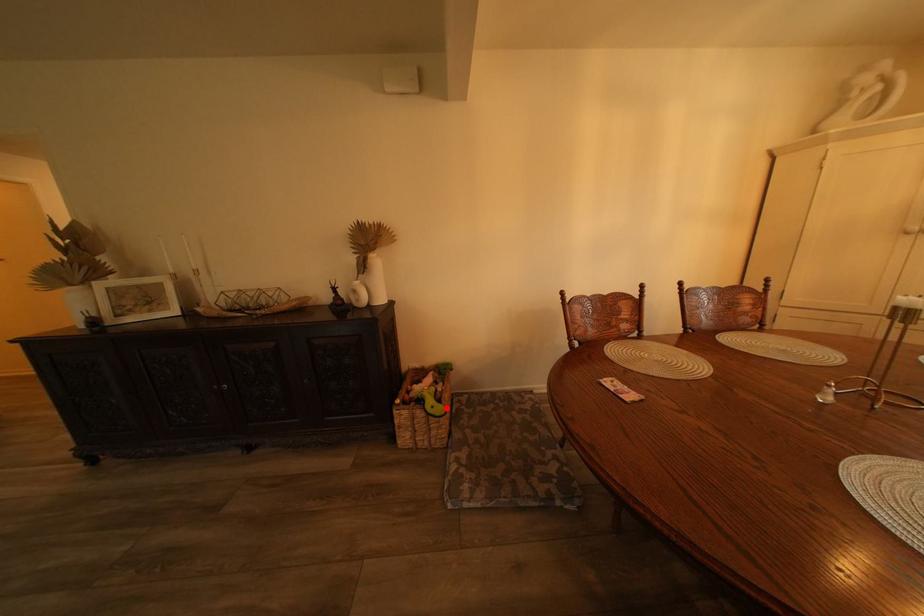
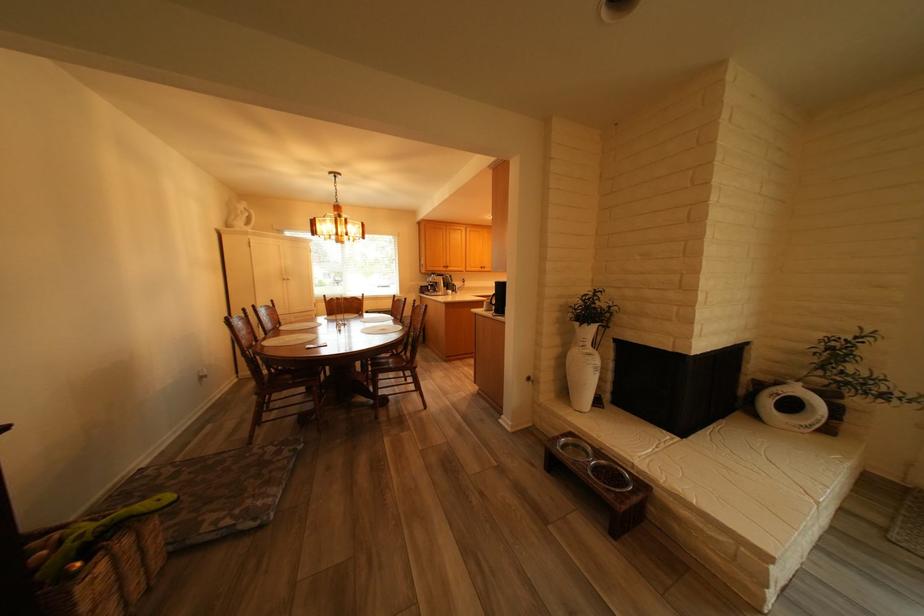
Where in the second image is the point corresponding to the highlighted location from the first image?

(174, 501)